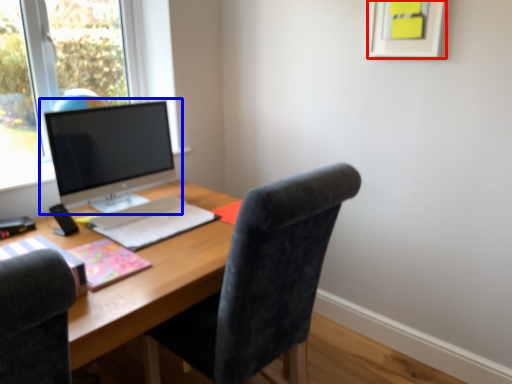
Question: Which object is further to the camera taking this photo, picture frame (highlighted by a red box) or computer monitor (highlighted by a blue box)?

Choices:
 (A) picture frame
 (B) computer monitor

Answer: (B)